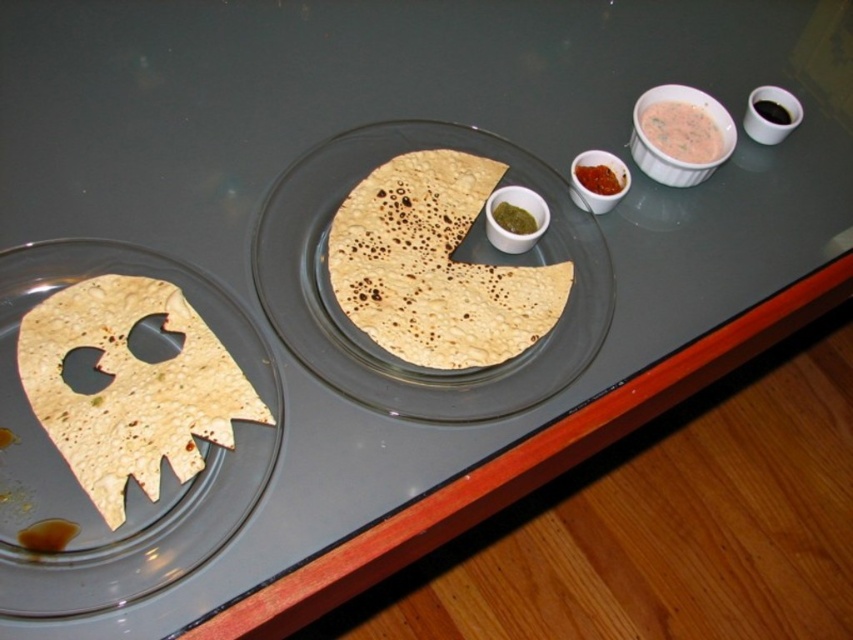
Which is more to the right, brown crispy tortilla at left or brown matte flatbread at center?

brown matte flatbread at center is more to the right.

Is brown crispy tortilla at left smaller than brown matte flatbread at center?

Yes.

This screenshot has height=640, width=853. I want to click on brown crispy tortilla at left, so click(x=131, y=387).

Does point (286, 280) come closer to viewer compared to point (672, 140)?

Yes, it is.

I want to click on matte glass plate at center, so click(x=370, y=340).

Is matte glass plate at center positioned before brown matte flatbread at center?

Yes, matte glass plate at center is in front of brown matte flatbread at center.

Which is below, matte glass plate at center or brown matte flatbread at center?

matte glass plate at center is below.

Image resolution: width=853 pixels, height=640 pixels. Identify the location of matte glass plate at center. (370, 340).

Locate an element on the screen. This screenshot has height=640, width=853. matte glass plate at center is located at coordinates (370, 340).